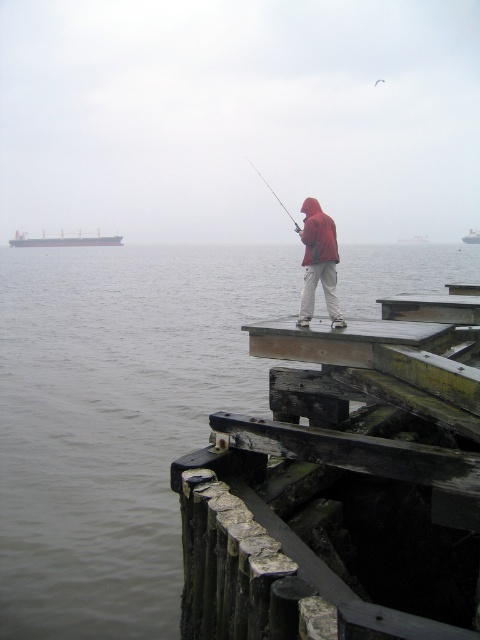
You are standing on the wooden pier and want to reach the point marked at coordinates [60,230]. The pier is 1000 feet long. Can you safely walk the entire length of the pier to reach that point?

The point at coordinates [60,230] is 703.08 feet away from the viewer. Since the pier is 1000 feet long, you can safely walk the entire length of the pier to reach that point as it is within the pier length.

You are standing on the wooden pier and want to know the position of the gray matte cargo ship at left relative to your current location. Based on the coordinates provided, can you determine if the ship is to your left or right?

The gray matte cargo ship at left is located at point coordinates, so based on the coordinates given, the ship is positioned to your left side.